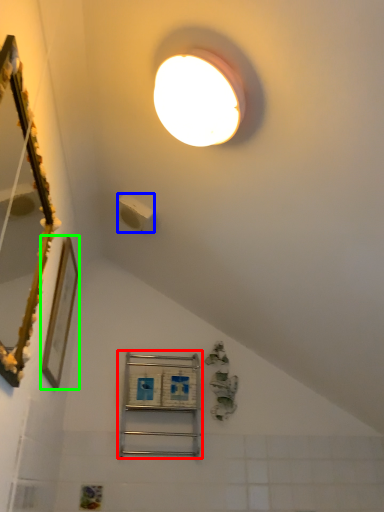
Question: Which object is positioned closest to shelf (highlighted by a red box)? Select from light switch (highlighted by a blue box) and picture frame (highlighted by a green box).

Choices:
 (A) light switch
 (B) picture frame

Answer: (B)